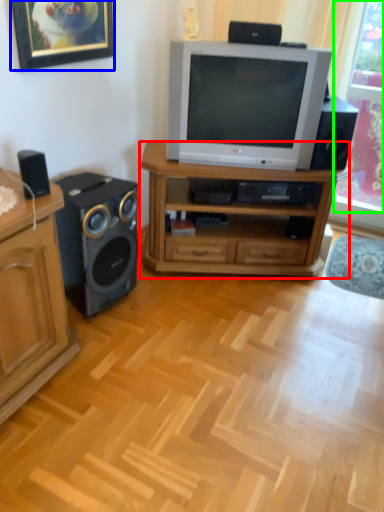
Question: Considering the real-world distances, which object is closest to desk (highlighted by a red box)? picture frame (highlighted by a blue box) or window screen (highlighted by a green box).

Choices:
 (A) picture frame
 (B) window screen

Answer: (A)